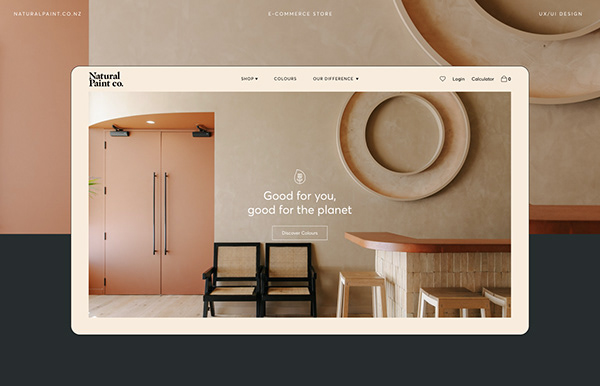
I want to click on flooring, so click(x=116, y=304).